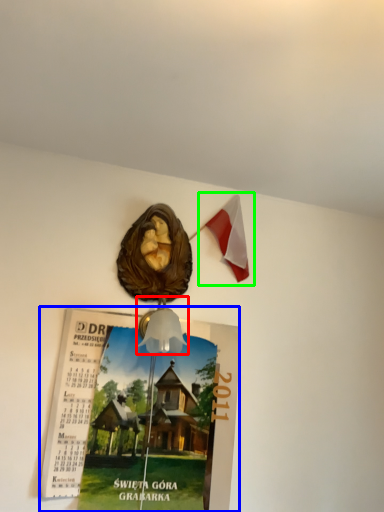
Question: Which object is the closest to the lamp (highlighted by a red box)? Choose among these: poster page (highlighted by a blue box) or flag (highlighted by a green box).

Choices:
 (A) poster page
 (B) flag

Answer: (A)